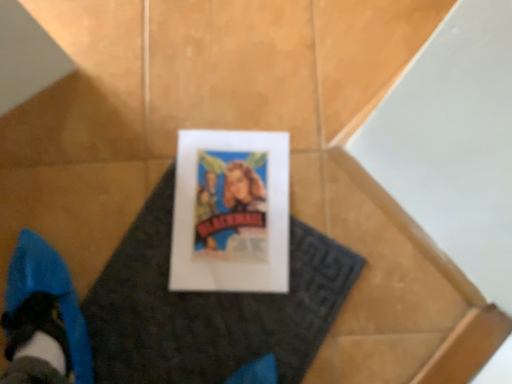
Where is `white paper at center`? white paper at center is located at coordinates (208, 308).

What do you see at coordinates (208, 308) in the screenshot?
I see `white paper at center` at bounding box center [208, 308].

Image resolution: width=512 pixels, height=384 pixels. Describe the element at coordinates (231, 212) in the screenshot. I see `white paper at center` at that location.

At what (x,y) coordinates should I click in order to perform the action: click on white paper at center. Please return your answer as a coordinate pair (x, y). Image resolution: width=512 pixels, height=384 pixels. Looking at the image, I should click on (231, 212).

The height and width of the screenshot is (384, 512). What are the coordinates of `white paper at center` in the screenshot? It's located at (208, 308).

Based on the photo, which is more to the right, white paper at center or white paper at center?

From the viewer's perspective, white paper at center appears more on the right side.

Relative to white paper at center, is white paper at center in front or behind?

white paper at center is positioned closer to the viewer than white paper at center.

Is point (190, 323) more distant than point (215, 178)?

No, (190, 323) is closer to viewer.

From the image's perspective, is white paper at center located beneath white paper at center?

Indeed, from the image's perspective, white paper at center is shown beneath white paper at center.

From a real-world perspective, which is physically above, white paper at center or white paper at center?

From a 3D spatial view, white paper at center is above.

Is white paper at center wider or thinner than white paper at center?

Considering their sizes, white paper at center looks broader than white paper at center.

Can you confirm if white paper at center is shorter than white paper at center?

Yes, white paper at center is shorter than white paper at center.

Who is bigger, white paper at center or white paper at center?

With larger size is white paper at center.

Would you say white paper at center is outside white paper at center?

white paper at center is positioned outside white paper at center.

Is white paper at center far away from white paper at center?

No.

Is white paper at center oriented towards white paper at center?

Yes, white paper at center is oriented towards white paper at center.

Can you tell me how much white paper at center and white paper at center differ in facing direction?

The angle between the facing direction of white paper at center and the facing direction of white paper at center is 31.4 degrees.

You are a GUI agent. You are given a task and a screenshot of the screen. Output one action in this format:
    pyautogui.click(x=<x>, y=<y>)
    Task: Click on the blanket beneath the white paper at center (from a real-world perspective)
    The width and height of the screenshot is (512, 384).
    Given the screenshot: What is the action you would take?
    pyautogui.click(x=208, y=308)

In the image, is white paper at center on the left side or the right side of white paper at center?

From the image, it's evident that white paper at center is to the right of white paper at center.

Is the depth of white paper at center greater than that of white paper at center?

Yes, it is behind white paper at center.

Does point (263, 210) lie in front of point (167, 192)?

Yes, point (263, 210) is in front of point (167, 192).

From the image's perspective, is white paper at center located above white paper at center?

Correct, white paper at center appears higher than white paper at center in the image.

From a real-world perspective, is white paper at center above or below white paper at center?

white paper at center is situated higher than white paper at center in the real world.

In terms of width, does white paper at center look wider or thinner when compared to white paper at center?

Clearly, white paper at center has less width compared to white paper at center.

Between white paper at center and white paper at center, which one has less height?

Standing shorter between the two is white paper at center.

Considering the sizes of objects white paper at center and white paper at center in the image provided, who is bigger, white paper at center or white paper at center?

With larger size is white paper at center.

Is white paper at center located outside white paper at center?

No, most part of white paper at center lies within white paper at center.

Is there a large distance between white paper at center and white paper at center?

No.

Could you tell me if white paper at center is facing white paper at center?

Yes, white paper at center faces towards white paper at center.

Where is `picture frame on the right of white paper at center`? picture frame on the right of white paper at center is located at coordinates (231, 212).

The height and width of the screenshot is (384, 512). I want to click on picture frame positioned vertically above the white paper at center (from a real-world perspective), so click(231, 212).

You are a GUI agent. You are given a task and a screenshot of the screen. Output one action in this format:
    pyautogui.click(x=<x>, y=<y>)
    Task: Click on the picture frame behind the white paper at center
    This screenshot has height=384, width=512.
    Given the screenshot: What is the action you would take?
    pyautogui.click(x=231, y=212)